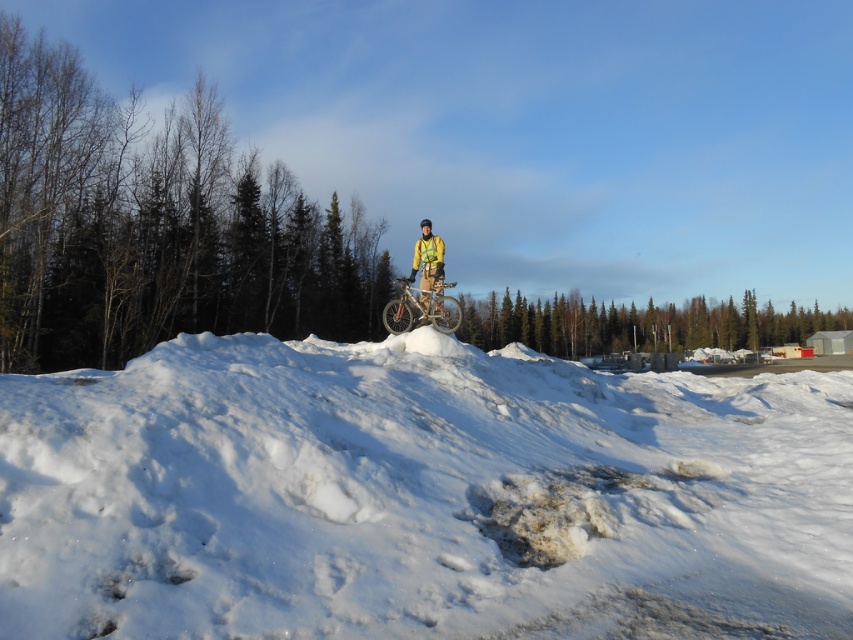
Can you confirm if silver metallic bicycle at center is positioned below yellow fabric jacket at center?

Incorrect, silver metallic bicycle at center is not positioned below yellow fabric jacket at center.

The image size is (853, 640). I want to click on silver metallic bicycle at center, so click(422, 308).

Image resolution: width=853 pixels, height=640 pixels. I want to click on silver metallic bicycle at center, so click(422, 308).

Can you confirm if white fluffy snow at center is wider than silver metallic bicycle at center?

Yes, white fluffy snow at center is wider than silver metallic bicycle at center.

Does white fluffy snow at center have a lesser width compared to silver metallic bicycle at center?

No, white fluffy snow at center is not thinner than silver metallic bicycle at center.

What do you see at coordinates (419, 497) in the screenshot?
I see `white fluffy snow at center` at bounding box center [419, 497].

Find the location of `white fluffy snow at center`. white fluffy snow at center is located at coordinates (419, 497).

Measure the distance between point (177, 355) and camera.

Point (177, 355) and camera are 7.40 meters apart from each other.

Between point (306, 460) and point (424, 296), which one is positioned behind?

The point (424, 296) is more distant.

Identify the location of white fluffy snow at center. (419, 497).